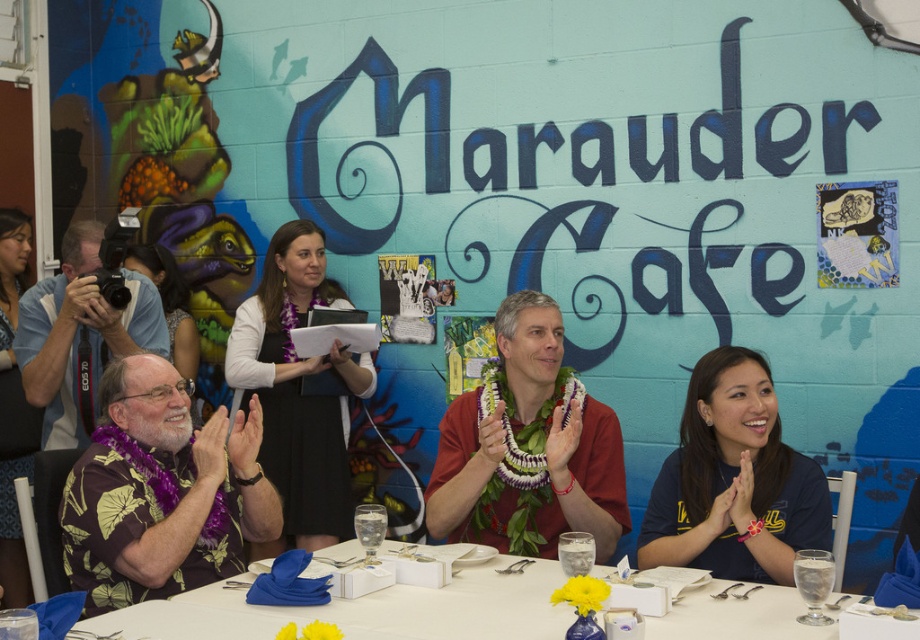
Question: Can you confirm if blue jersey at center is thinner than purple fabric lei at center?

Choices:
 (A) no
 (B) yes

Answer: (B)

Question: Does reddish-brown fabric lei at center appear on the right side of white glossy table at center?

Choices:
 (A) no
 (B) yes

Answer: (B)

Question: Can you confirm if reddish-brown fabric lei at center is bigger than blue jersey at center?

Choices:
 (A) yes
 (B) no

Answer: (A)

Question: Which of the following is the farthest from the observer?

Choices:
 (A) (274, 259)
 (B) (590, 440)
 (C) (719, 452)

Answer: (A)

Question: Considering the real-world distances, which object is closest to the white glossy table at center?

Choices:
 (A) reddish-brown fabric lei at center
 (B) blue jersey at center

Answer: (B)

Question: Which point appears farthest from the camera in this image?

Choices:
 (A) (346, 515)
 (B) (605, 516)
 (C) (690, 417)
 (D) (549, 564)

Answer: (A)